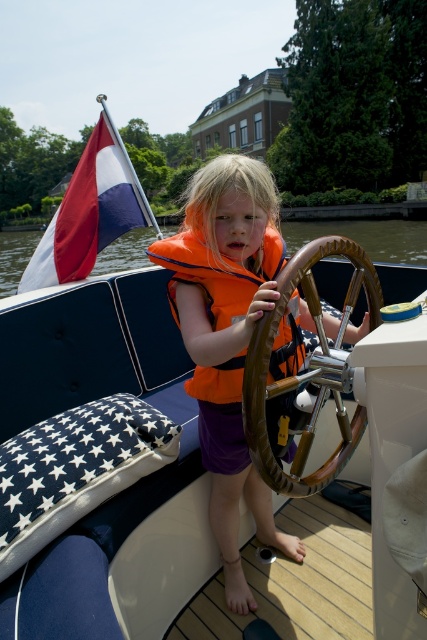
What are the coordinates of the brown leather steering wheel at center?

The coordinates of the brown leather steering wheel at center are at point (307, 369).